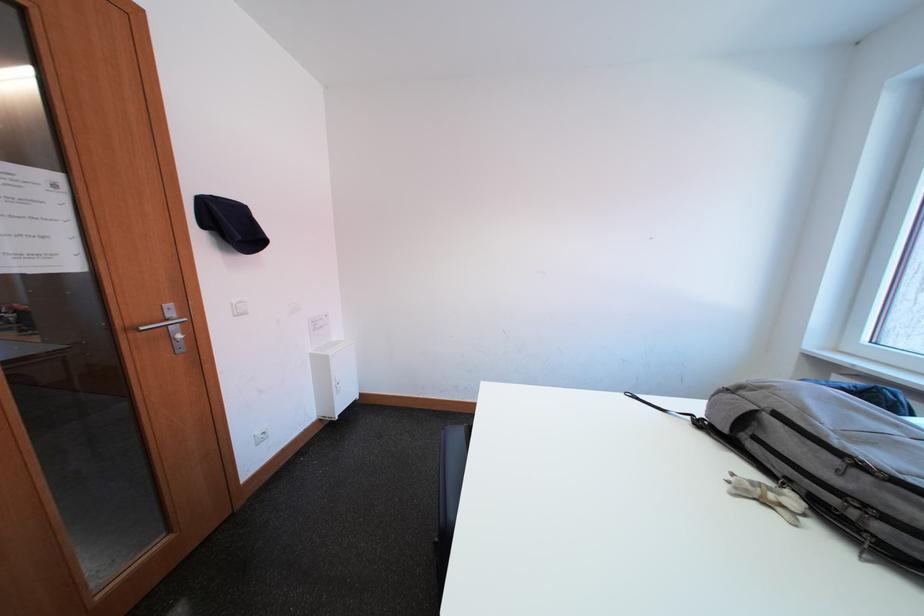
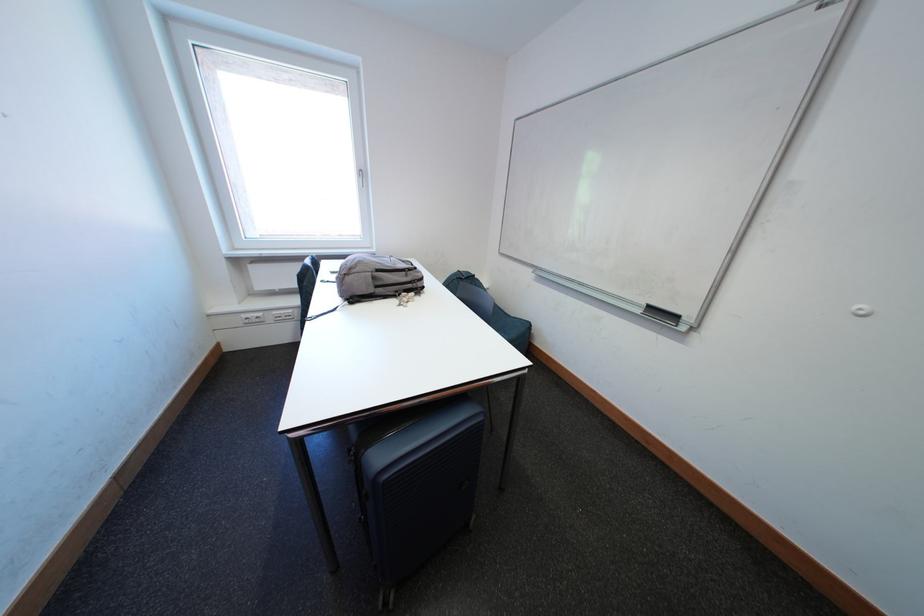
The point at (798, 484) is marked in the first image. Where is the corresponding point in the second image?

(406, 294)